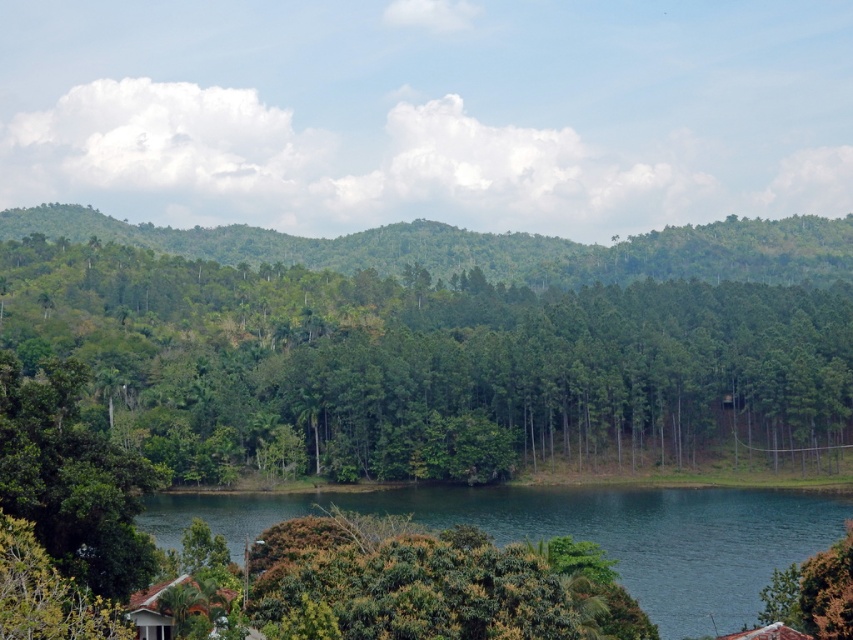
Is green leafy trees at center positioned behind white shingled hut at lower left?

Yes.

Can you confirm if green leafy trees at center is positioned to the left of white shingled hut at lower left?

Yes, green leafy trees at center is to the left of white shingled hut at lower left.

Between point (621, 464) and point (134, 609), which one is positioned behind?

The point (621, 464) is more distant.

Find the location of a particular element. This screenshot has width=853, height=640. green leafy trees at center is located at coordinates (428, 365).

Does green leafy trees at center appear over green leafy hillside at center?

No.

Identify the location of green leafy trees at center. The width and height of the screenshot is (853, 640). (428, 365).

Is point (270, 397) positioned before point (300, 259)?

Yes, it is in front of point (300, 259).

Image resolution: width=853 pixels, height=640 pixels. I want to click on green leafy trees at center, so click(x=428, y=365).

Does point (670, 560) come behind point (252, 227)?

That is False.

In the scene shown: Does clear blue water at bottom come behind green leafy hillside at center?

No, it is in front of green leafy hillside at center.

Which is in front, point (734, 506) or point (473, 243)?

Positioned in front is point (734, 506).

This screenshot has height=640, width=853. What are the coordinates of `clear blue water at bottom` in the screenshot? It's located at (581, 532).